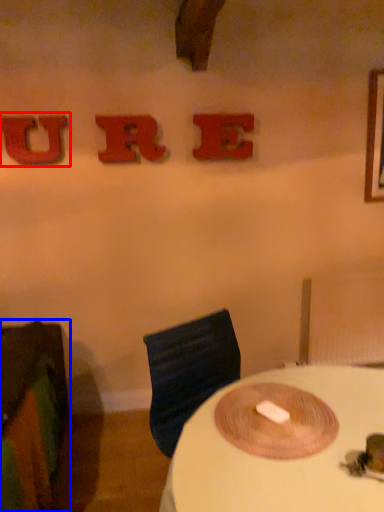
Question: Among these objects, which one is farthest to the camera, alphabet (highlighted by a red box) or furniture (highlighted by a blue box)?

Choices:
 (A) alphabet
 (B) furniture

Answer: (A)